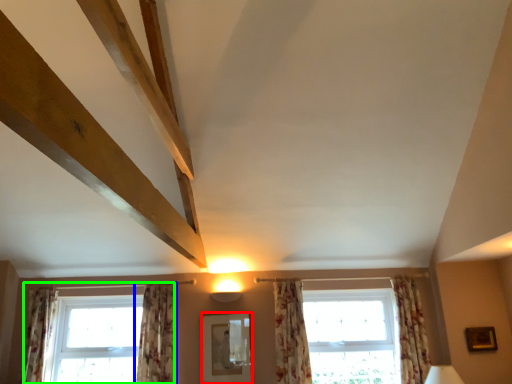
Question: Estimate the real-world distances between objects in this image. Which object is farther from mirror (highlighted by a red box), curtain (highlighted by a blue box) or window (highlighted by a green box)?

Choices:
 (A) curtain
 (B) window

Answer: (B)